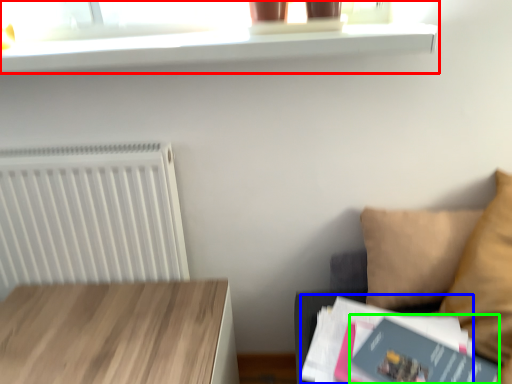
Question: Which object is the farthest from shelf (highlighted by a red box)? Choose among these: paperback book (highlighted by a blue box) or paperback book (highlighted by a green box).

Choices:
 (A) paperback book
 (B) paperback book

Answer: (B)